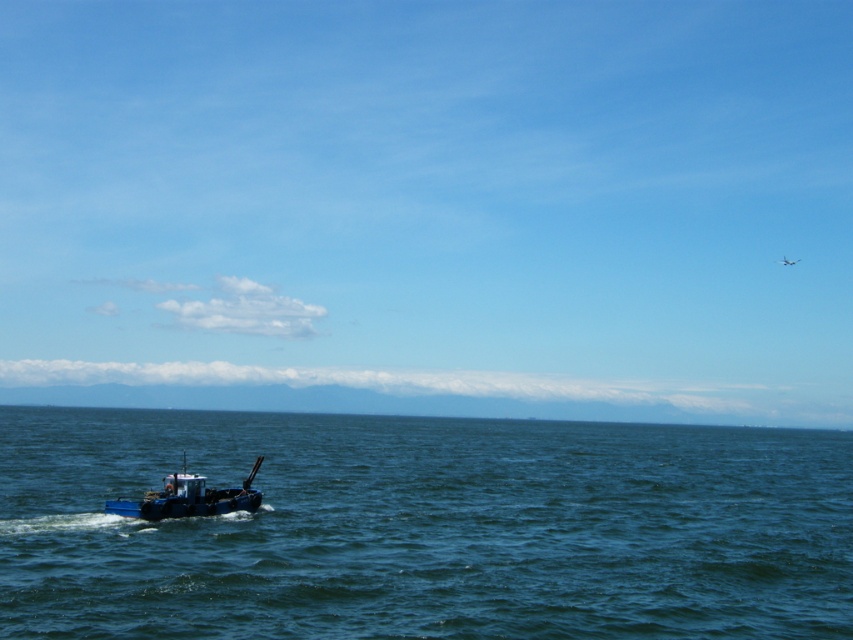
Question: Does dark blue water at lower left lie behind blue matte boat at lower left?

Choices:
 (A) yes
 (B) no

Answer: (B)

Question: Can you confirm if dark blue water at lower left is positioned to the right of blue matte boat at lower left?

Choices:
 (A) yes
 (B) no

Answer: (A)

Question: Which of the following is the farthest from the observer?

Choices:
 (A) dark blue water at lower left
 (B) blue matte boat at lower left

Answer: (B)

Question: Is dark blue water at lower left above blue matte boat at lower left?

Choices:
 (A) no
 (B) yes

Answer: (A)

Question: Which point appears farthest from the camera in this image?

Choices:
 (A) (258, 461)
 (B) (39, 596)

Answer: (A)